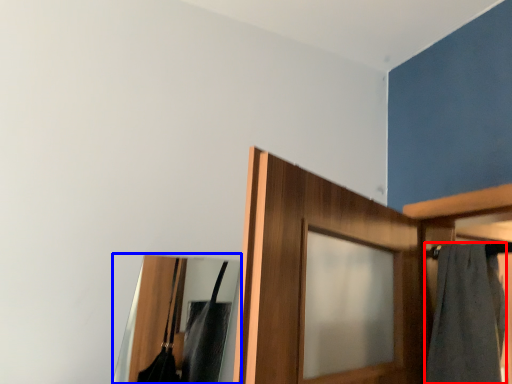
Question: Among these objects, which one is nearest to the camera, bath towel (highlighted by a red box) or mirror (highlighted by a blue box)?

Choices:
 (A) bath towel
 (B) mirror

Answer: (B)